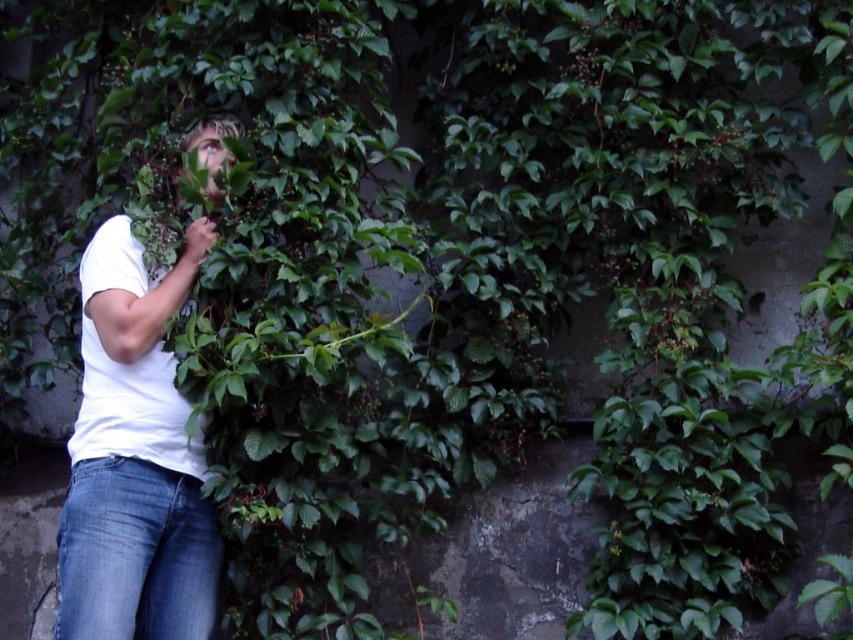
Question: In this image, where is white cotton shirt at left located relative to white matte t-shirt at left?

Choices:
 (A) above
 (B) below

Answer: (B)

Question: Among these objects, which one is nearest to the camera?

Choices:
 (A) denim jeans at lower left
 (B) white matte t-shirt at left
 (C) white cotton shirt at left

Answer: (A)

Question: Among these points, which one is farthest from the camera?

Choices:
 (A) (236, 131)
 (B) (103, 584)
 (C) (158, 390)

Answer: (A)

Question: Does denim jeans at lower left have a larger size compared to white matte t-shirt at left?

Choices:
 (A) no
 (B) yes

Answer: (B)

Question: Among these objects, which one is nearest to the camera?

Choices:
 (A) white matte t-shirt at left
 (B) white cotton shirt at left

Answer: (B)

Question: Does white cotton shirt at left have a lesser width compared to denim jeans at lower left?

Choices:
 (A) no
 (B) yes

Answer: (A)